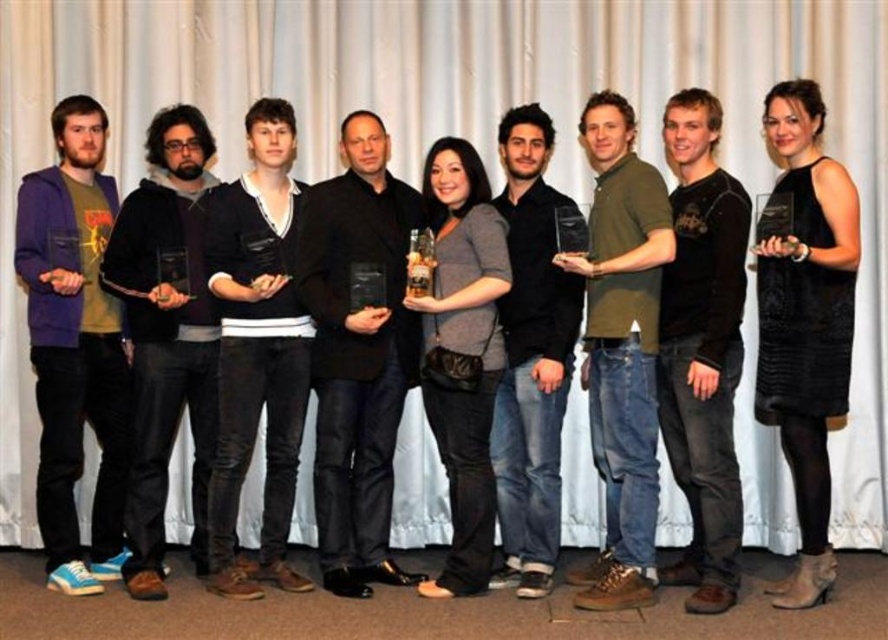
Does purple fleece jacket at left come behind dark blue jeans at center?

That is False.

Who is more forward, (115,300) or (546,440)?

Positioned in front is point (546,440).

You are a GUI agent. You are given a task and a screenshot of the screen. Output one action in this format:
    pyautogui.click(x=<x>, y=<y>)
    Task: Click on the purple fleece jacket at left
    
    Given the screenshot: What is the action you would take?
    pyautogui.click(x=74, y=346)

Identify the location of matte black hoodie at left. (167, 333).

Is matte black hoodie at left taller than black matte shirt at center?

No.

Does point (136, 262) come in front of point (676, 172)?

Yes, point (136, 262) is closer to viewer.

Locate an element on the screen. The width and height of the screenshot is (888, 640). matte black hoodie at left is located at coordinates (167, 333).

Is black matte jacket at center to the left of black matte shirt at center from the viewer's perspective?

Correct, you'll find black matte jacket at center to the left of black matte shirt at center.

Does point (312, 285) come farther from viewer compared to point (712, 358)?

Yes, point (312, 285) is behind point (712, 358).

Who is more distant from viewer, (341,476) or (708,472)?

The point (341,476) is behind.

Locate an element on the screen. The height and width of the screenshot is (640, 888). black matte jacket at center is located at coordinates click(357, 355).